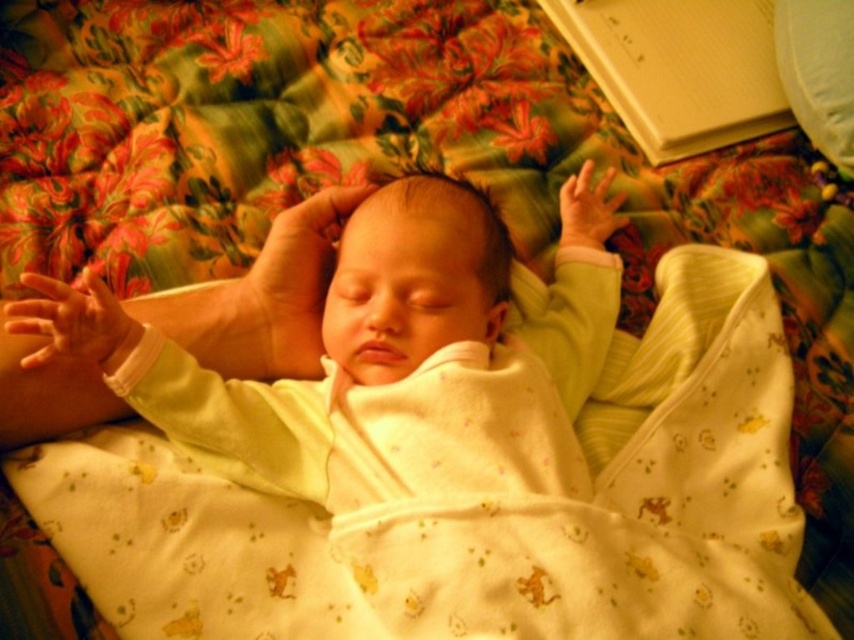
You are a parent holding a soft yellow fabric baby at center. You want to place it on a shelf that is 60 centimeters away from you. Can the baby reach the shelf?

The soft yellow fabric baby at center is 57.19 centimeters away from the viewer, so placing it on a shelf 60 centimeters away would require moving it an additional 2.81 centimeters forward.

You are a photographer standing at a certain distance from the bed where the baby is sleeping. You want to take a photo of the baby while ensuring the camera is positioned exactly 30 inches away from the point marked as point (601, 332). Based on the scene description, can you adjust your position to achieve this requirement?

The distance between point (601, 332) and the camera is currently 31.31 inches. To meet the requirement of 30 inches, you would need to move the camera approximately 1.31 inches closer to the point (601, 332).